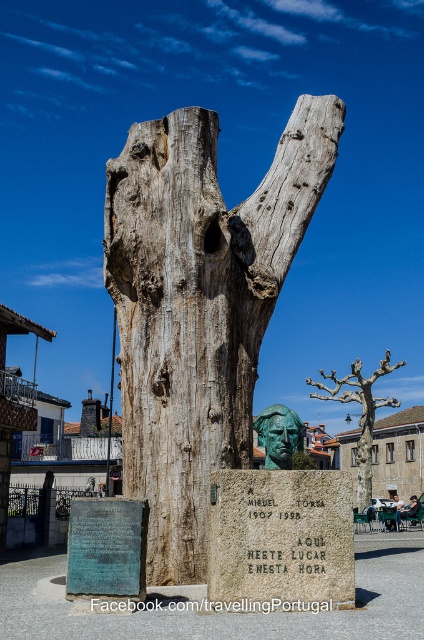
Is weathered wood tree trunk at center bigger than green patina bronze bust at center?

Yes.

Between weathered wood tree trunk at center and green patina bronze bust at center, which one is positioned higher?

Positioned higher is weathered wood tree trunk at center.

Who is more distant from viewer, (x=137, y=332) or (x=289, y=461)?

Positioned behind is point (x=137, y=332).

You are a GUI agent. You are given a task and a screenshot of the screen. Output one action in this format:
    pyautogui.click(x=<x>, y=<y>)
    Task: Click on the weathered wood tree trunk at center
    Image resolution: width=424 pixels, height=640 pixels.
    Given the screenshot: What is the action you would take?
    pyautogui.click(x=198, y=307)

Who is shorter, bare wood tree at center or green patina bronze bust at center?

green patina bronze bust at center is shorter.

Does bare wood tree at center have a larger size compared to green patina bronze bust at center?

Correct, bare wood tree at center is larger in size than green patina bronze bust at center.

What are the coordinates of `bare wood tree at center` in the screenshot? It's located at (360, 413).

Does weathered wood tree trunk at center have a greater width compared to bare wood tree at center?

In fact, weathered wood tree trunk at center might be narrower than bare wood tree at center.

Which is in front, point (139, 298) or point (359, 426)?

Positioned in front is point (139, 298).

Identify the location of weathered wood tree trunk at center. Image resolution: width=424 pixels, height=640 pixels. tap(198, 307).